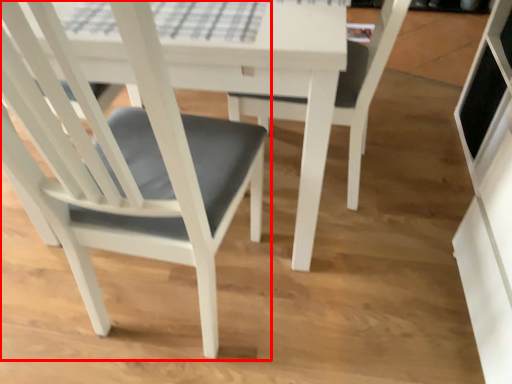
Question: Where is chair (annotated by the red box) located in relation to chair in the image?

Choices:
 (A) left
 (B) right

Answer: (A)